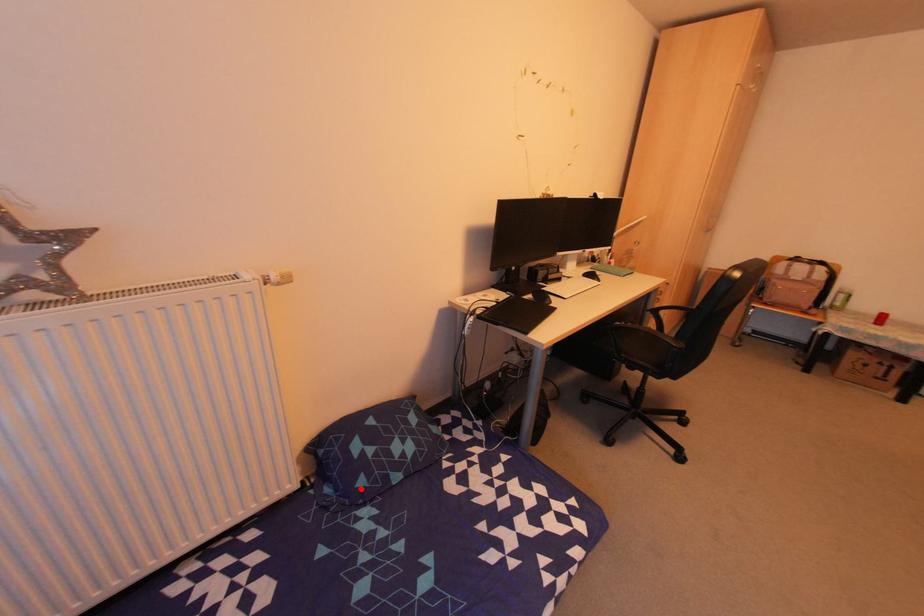
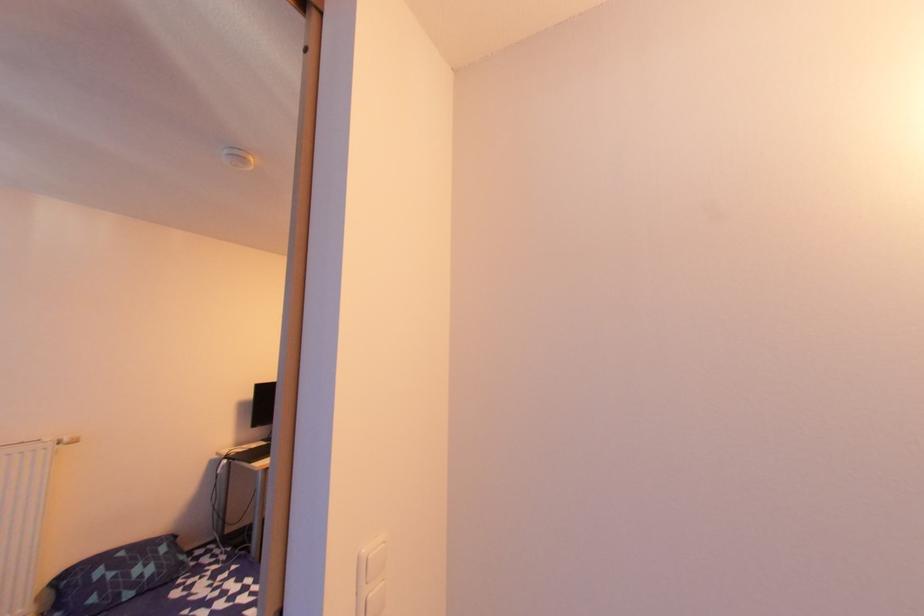
Where in the second image is the point corresponding to the highlighted location from the first image?

(90, 605)